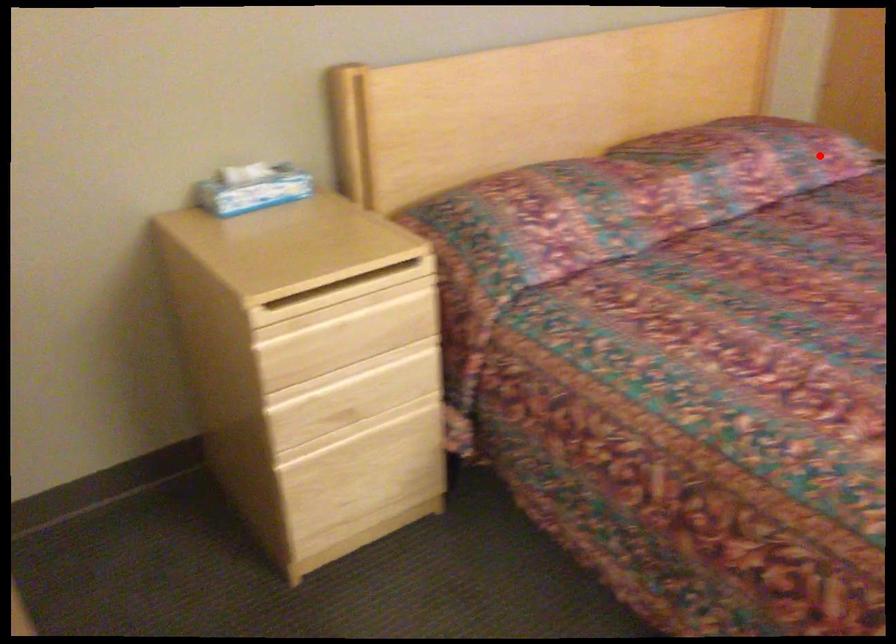
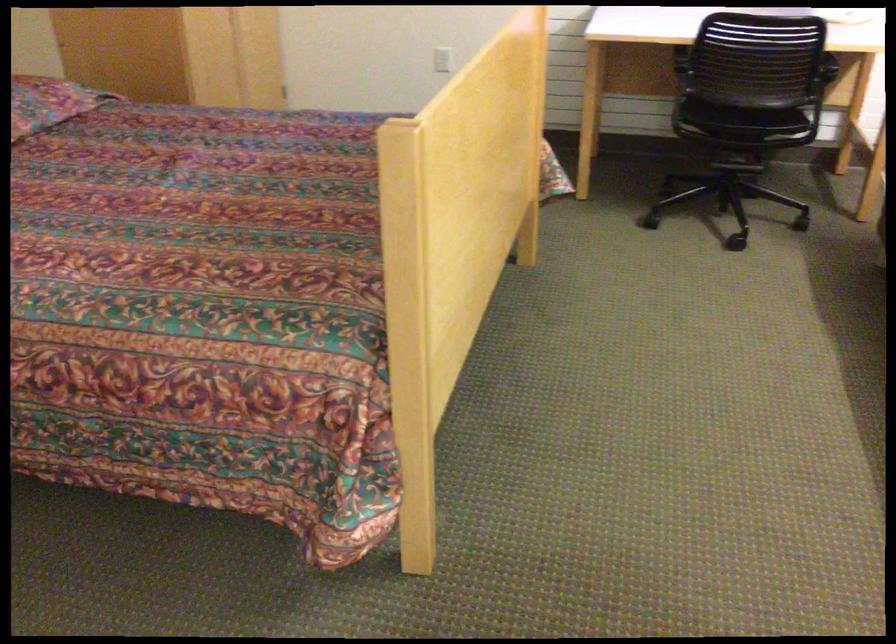
Locate, in the second image, the point that corresponds to the highlighted location in the first image.

(48, 102)